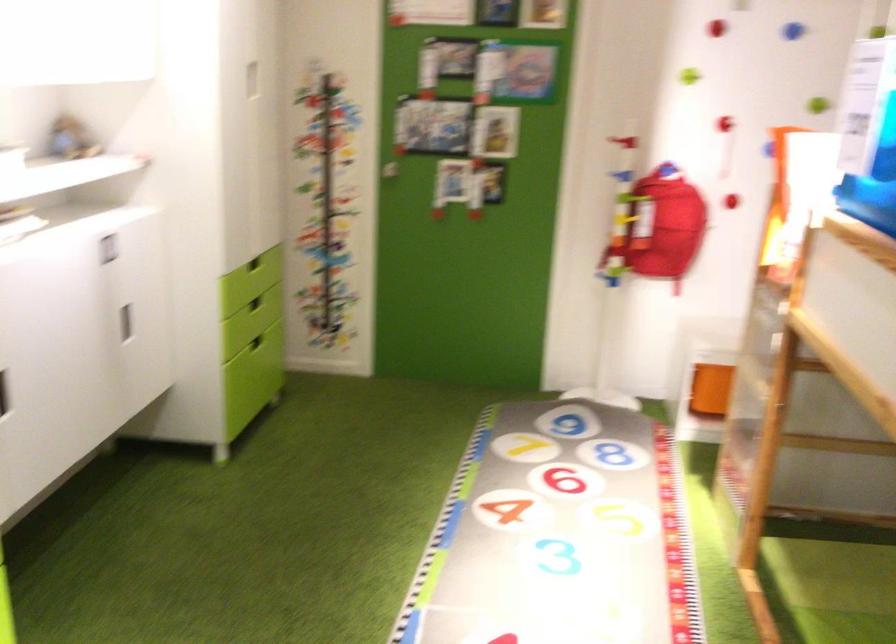
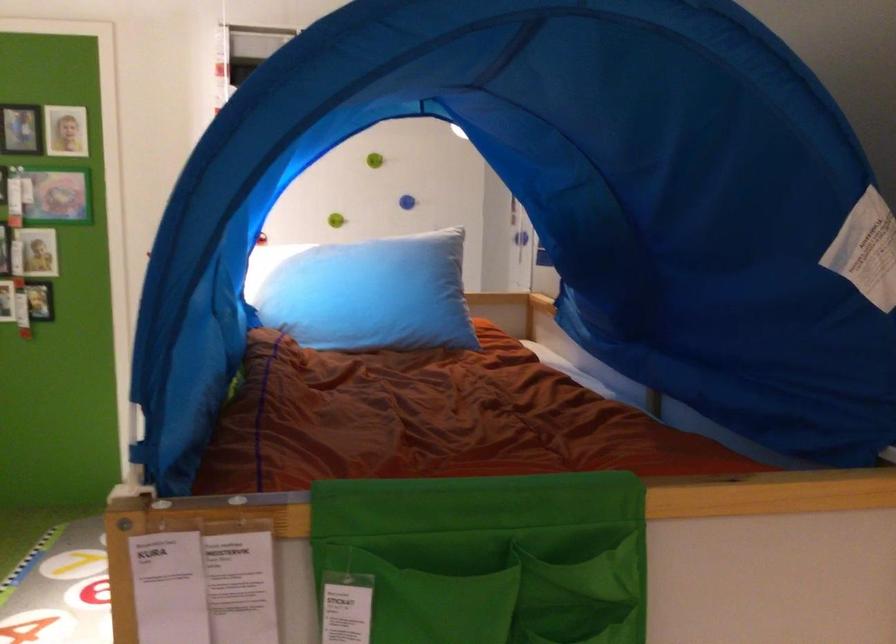
In the second image, find the point that corresponds to point (489, 169) in the first image.

(39, 301)